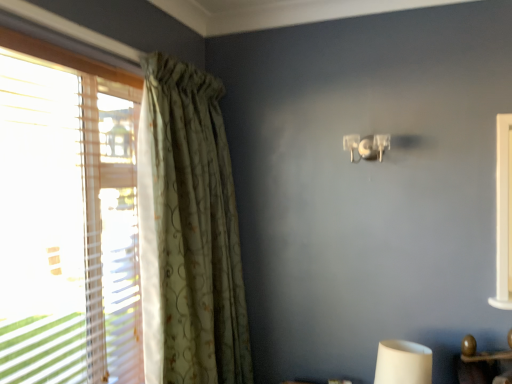
Question: Looking at the image, does green floral fabric curtain at left seem bigger or smaller compared to clear plastic lamp at upper center?

Choices:
 (A) big
 (B) small

Answer: (A)

Question: Is green floral fabric curtain at left inside or outside of clear plastic lamp at upper center?

Choices:
 (A) inside
 (B) outside

Answer: (B)

Question: From the image's perspective, is green floral fabric curtain at left located above or below clear plastic lamp at upper center?

Choices:
 (A) below
 (B) above

Answer: (A)

Question: Considering the positions of clear plastic lamp at upper center and green floral fabric curtain at left in the image, is clear plastic lamp at upper center wider or thinner than green floral fabric curtain at left?

Choices:
 (A) thin
 (B) wide

Answer: (A)

Question: Does point (352, 137) appear closer or farther from the camera than point (155, 263)?

Choices:
 (A) farther
 (B) closer

Answer: (A)

Question: From a real-world perspective, relative to green floral fabric curtain at left, is clear plastic lamp at upper center vertically above or below?

Choices:
 (A) above
 (B) below

Answer: (A)

Question: Visually, is clear plastic lamp at upper center positioned to the left or to the right of green floral fabric curtain at left?

Choices:
 (A) right
 (B) left

Answer: (A)